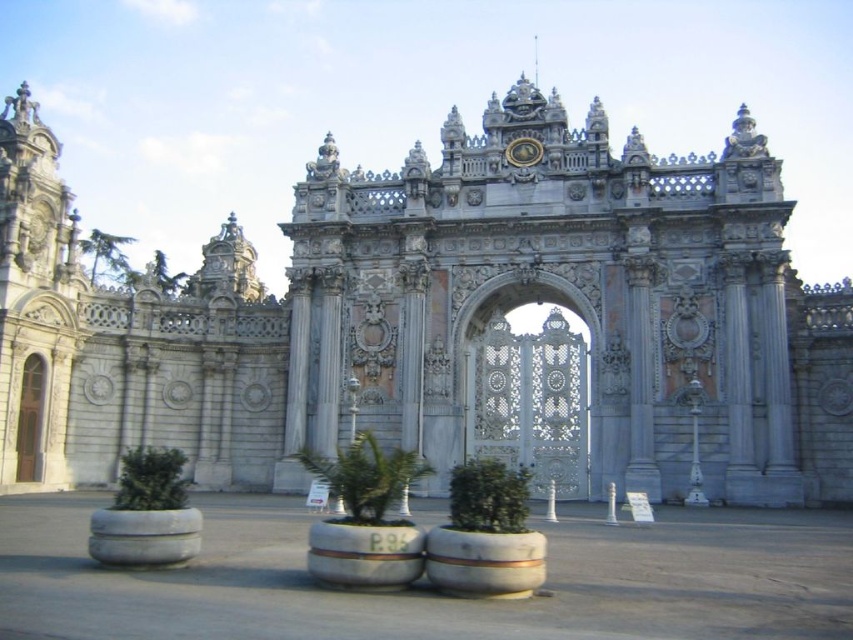
Question: Can you confirm if white stone gate at center is thinner than wooden door at left?

Choices:
 (A) no
 (B) yes

Answer: (A)

Question: Is white stone gate at center wider than wooden door at left?

Choices:
 (A) no
 (B) yes

Answer: (B)

Question: Among these objects, which one is farthest from the camera?

Choices:
 (A) wooden door at left
 (B) white stone gate at center

Answer: (A)

Question: Can you confirm if white stone gate at center is bigger than wooden door at left?

Choices:
 (A) yes
 (B) no

Answer: (A)

Question: Which point is farther to the camera?

Choices:
 (A) wooden door at left
 (B) white stone gate at center

Answer: (A)